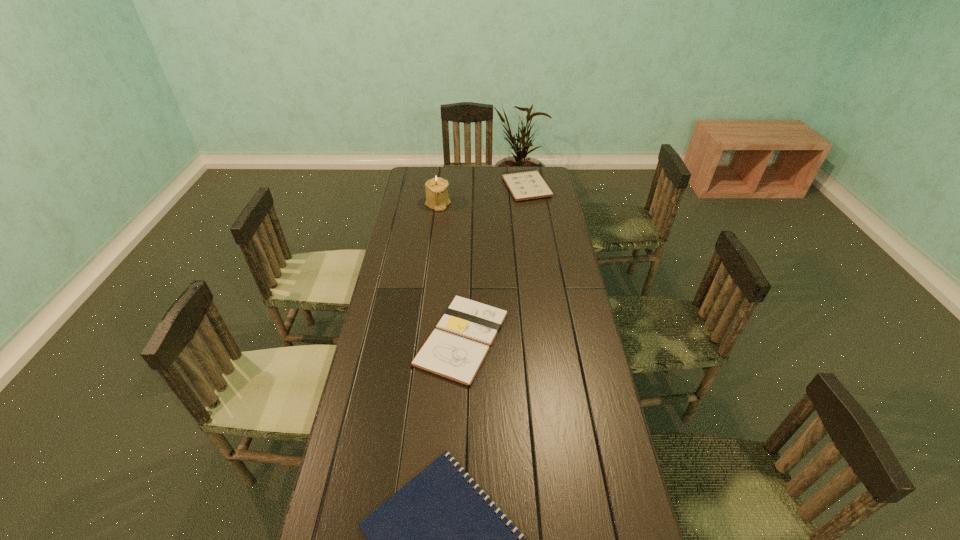
Find the location of a particular element. The height and width of the screenshot is (540, 960). notepad that is at the left edge is located at coordinates (456, 349).

You are a GUI agent. You are given a task and a screenshot of the screen. Output one action in this format:
    pyautogui.click(x=<x>, y=<y>)
    Task: Click on the object that is positioned at the right edge
    
    Given the screenshot: What is the action you would take?
    pos(527,185)

Find the location of a particular element. Image resolution: width=960 pixels, height=540 pixels. object that is at the far right corner is located at coordinates (527, 185).

Image resolution: width=960 pixels, height=540 pixels. I want to click on vacant space at the far edge, so click(x=492, y=179).

In the image, there is a desktop. Where is `vacant space at the left edge`? This screenshot has width=960, height=540. vacant space at the left edge is located at coordinates (418, 213).

This screenshot has height=540, width=960. Identify the location of vacant space at the right edge of the desktop. (596, 432).

Locate an element on the screen. The height and width of the screenshot is (540, 960). free space between the third farthest object and the tallest object is located at coordinates (450, 272).

You are a GUI agent. You are given a task and a screenshot of the screen. Output one action in this format:
    pyautogui.click(x=<x>, y=<y>)
    Task: Click on the empty space between the second shortest notepad and the candle_holder
    This screenshot has width=960, height=540.
    Given the screenshot: What is the action you would take?
    pyautogui.click(x=450, y=272)

Locate an element on the screen. This screenshot has width=960, height=540. empty space between the tallest notepad and the second shortest object is located at coordinates (494, 263).

The width and height of the screenshot is (960, 540). Find the location of `vacant point located between the candle_holder and the tallest notepad`. vacant point located between the candle_holder and the tallest notepad is located at coordinates (482, 195).